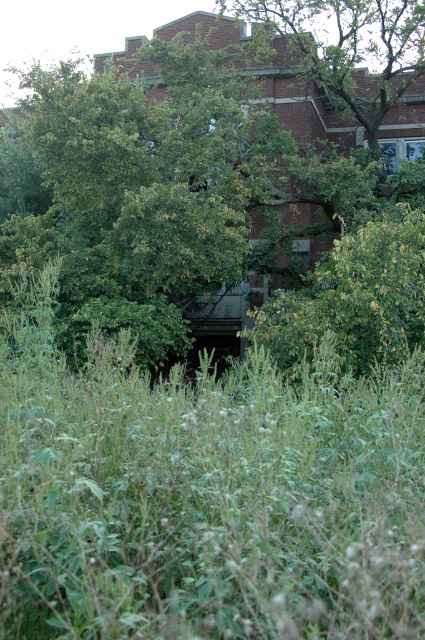
Who is positioned more to the right, green leafy grass at center or green leafy tree at upper center?

Positioned to the right is green leafy tree at upper center.

Is green leafy grass at center to the left of green leafy tree at upper center from the viewer's perspective?

Yes, green leafy grass at center is to the left of green leafy tree at upper center.

Image resolution: width=425 pixels, height=640 pixels. What are the coordinates of `green leafy grass at center` in the screenshot? It's located at (210, 500).

Identify the location of green leafy tree at center. (232, 179).

Between green leafy tree at center and green leafy grass at center, which one appears on the left side from the viewer's perspective?

green leafy tree at center is more to the left.

Measure the distance between green leafy tree at center and camera.

green leafy tree at center and camera are 28.16 feet apart.

The image size is (425, 640). In order to click on green leafy tree at center in this screenshot , I will do `click(232, 179)`.

Does green leafy tree at center have a greater width compared to green leafy tree at upper center?

Yes.

Can you confirm if green leafy tree at center is positioned above green leafy tree at upper center?

Incorrect, green leafy tree at center is not positioned above green leafy tree at upper center.

Identify the location of green leafy tree at center. (232, 179).